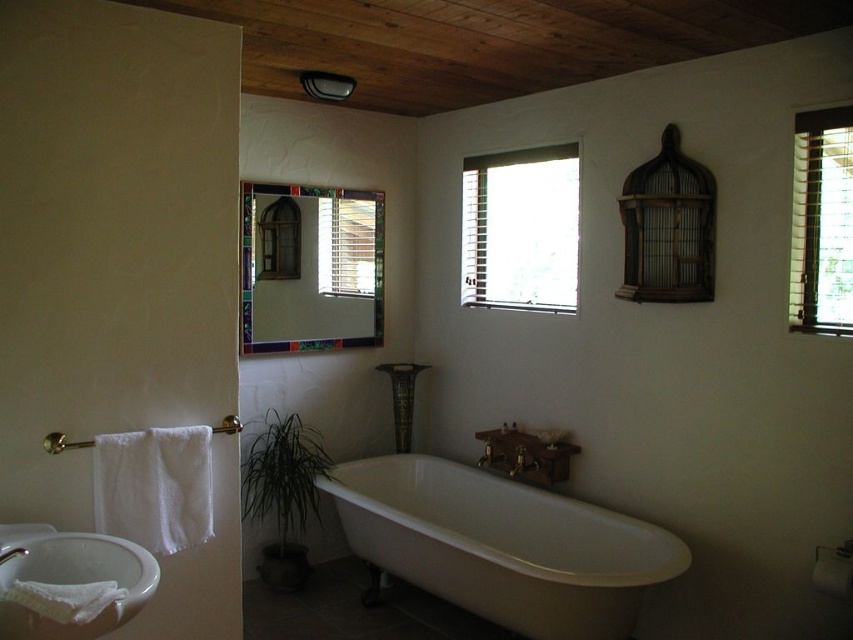
You are standing in the bathroom and want to place a small plant between the two points labeled point (270, 330) and point (132, 548). Which point should the plant be closer to in order to be closer to the viewer?

The plant should be closer to point (270, 330) because it is further to the viewer than point (132, 548).

You are standing in the bathroom and want to place a small plant between the two points, point [422,552] and point [113,609]. Which point should the plant be closer to in order to be closer to the viewer?

The plant should be closer to point [422,552] because it is further to the viewer than point [113,609].